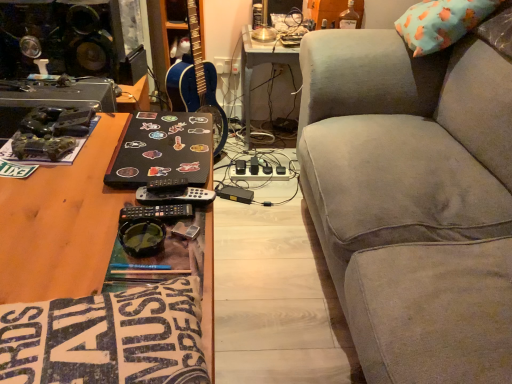
Question: Is sticker-covered black laptop at center spatially inside black plastic remote at center, or outside of it?

Choices:
 (A) outside
 (B) inside

Answer: (A)

Question: Looking at their shapes, would you say sticker-covered black laptop at center is wider or thinner than black plastic remote at center?

Choices:
 (A) thin
 (B) wide

Answer: (B)

Question: Estimate the real-world distances between objects in this image. Which object is farther from the sticker-covered black laptop at center?

Choices:
 (A) blue glossy guitar at center
 (B) black plastic remote at center
 (C) green rubber goggles at center
 (D) white plastic table at center
 (E) wooden desk at lower left

Answer: (D)

Question: Based on their relative distances, which object is farther from the white plastic table at center?

Choices:
 (A) blue glossy guitar at center
 (B) green rubber goggles at center
 (C) sticker-covered black laptop at center
 (D) wooden desk at lower left
 (E) gray fabric couch at right

Answer: (B)